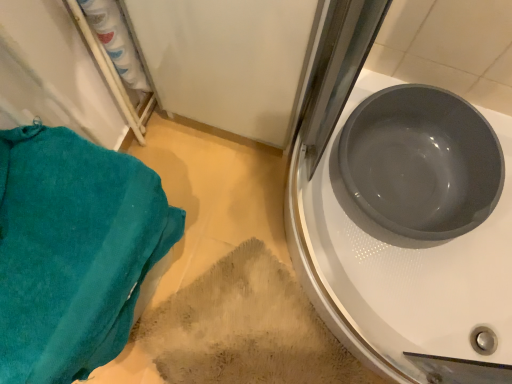
Find the location of a particular element. The height and width of the screenshot is (384, 512). free point above beige textured rug at lower center (from a real-world perspective) is located at coordinates click(251, 338).